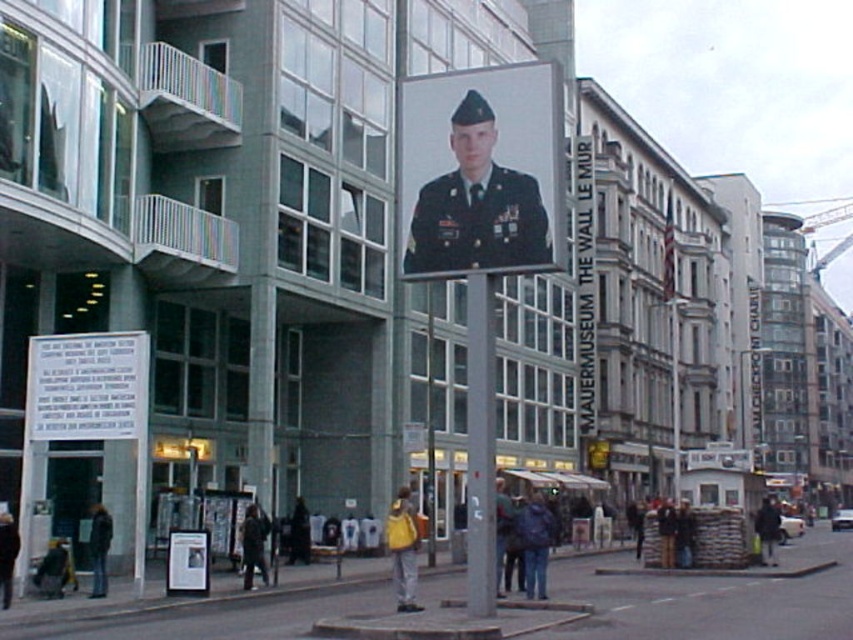
You are a tourist holding a dark brown leather jacket at lower center and want to take a photo of the matte black poster at center. Can you stand to the right of the jacket to frame the poster properly?

The matte black poster at center is positioned on the left side of dark brown leather jacket at lower center, so standing to the right of the jacket would place you further away from the poster, making it harder to frame properly. You should move to the left of the jacket instead.

You are a tourist in Berlin and see the image. You want to find the MAUERMUSEUM THE WALL LE MUR. According to the image, where is the museum located relative to the point marked at coordinates point (473, 186)?

The museum is located at the point marked at coordinates point (473, 186), as the point indicates the matte black uniform at center, which is part of the museum billboard.